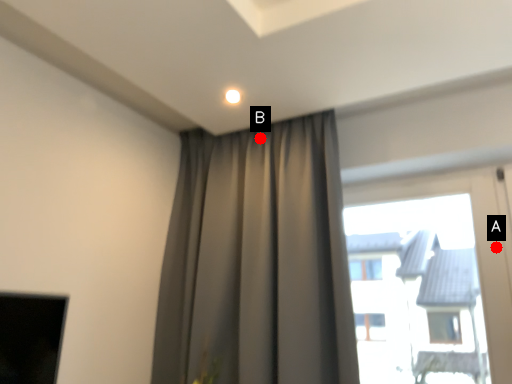
Question: Two points are circled on the image, labeled by A and B beside each circle. Which point is farther from the camera taking this photo?

Choices:
 (A) A is further
 (B) B is further

Answer: (B)